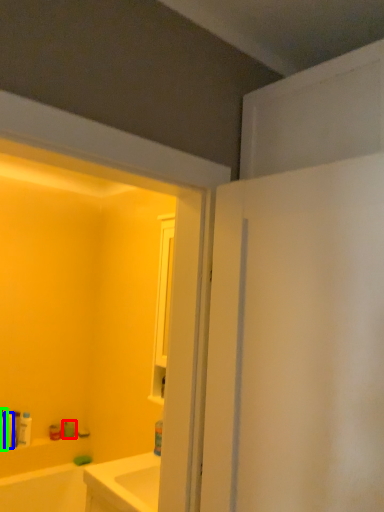
Question: Estimate the real-world distances between objects in this image. Which object is farther from toiletry (highlighted by a red box), toiletry (highlighted by a blue box) or toiletry (highlighted by a green box)?

Choices:
 (A) toiletry
 (B) toiletry

Answer: (B)